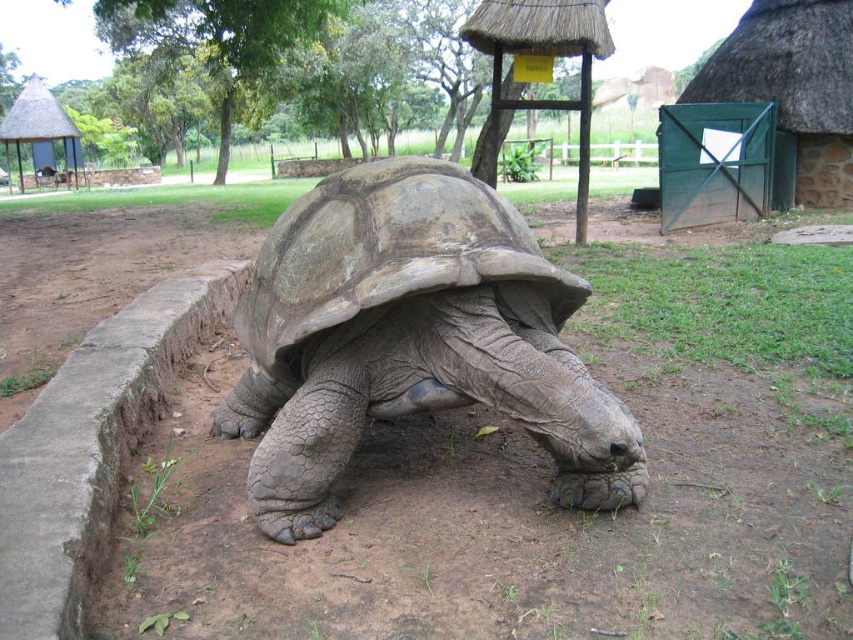
You are a zookeeper planning to install a new feeding station for the leathery brown tortoise at center. The feeding station needs to be placed at the same height as the tortoise to make it easy for it to eat. Where should you position the feeding station relative to the thatched straw hut at upper left?

The leathery brown tortoise at center is shorter than the thatched straw hut at upper left. Therefore, the feeding station should be positioned lower than the thatched straw hut at upper left to match the tortoise height.

You are standing in the zoo and want to observe the tortoise. If you move 2 meters closer to the point at coordinates point (717, 291), how far will you be from that point?

The point at coordinates point (717, 291) is initially 4.80 meters away. Moving 2 meters closer would reduce the distance to 2.80 meters.